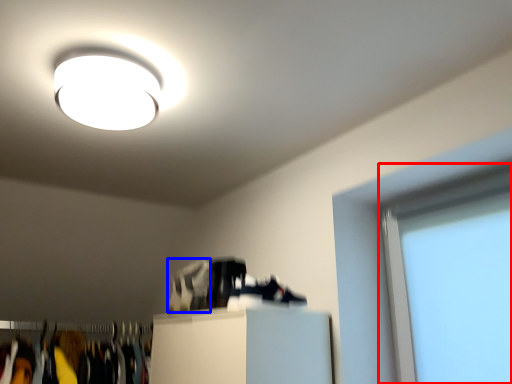
Question: Which object is closer to the camera taking this photo, window screen (highlighted by a red box) or shoe (highlighted by a blue box)?

Choices:
 (A) window screen
 (B) shoe

Answer: (A)